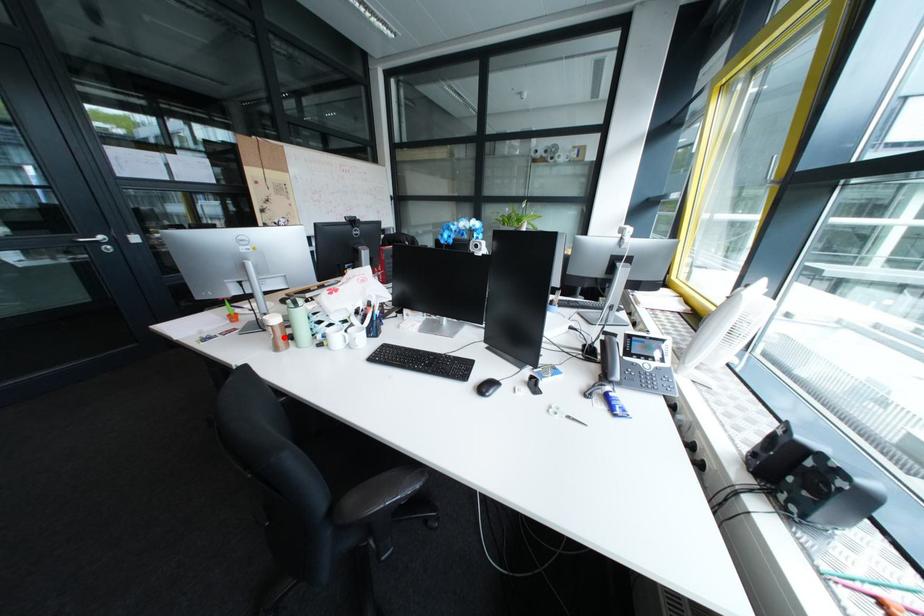
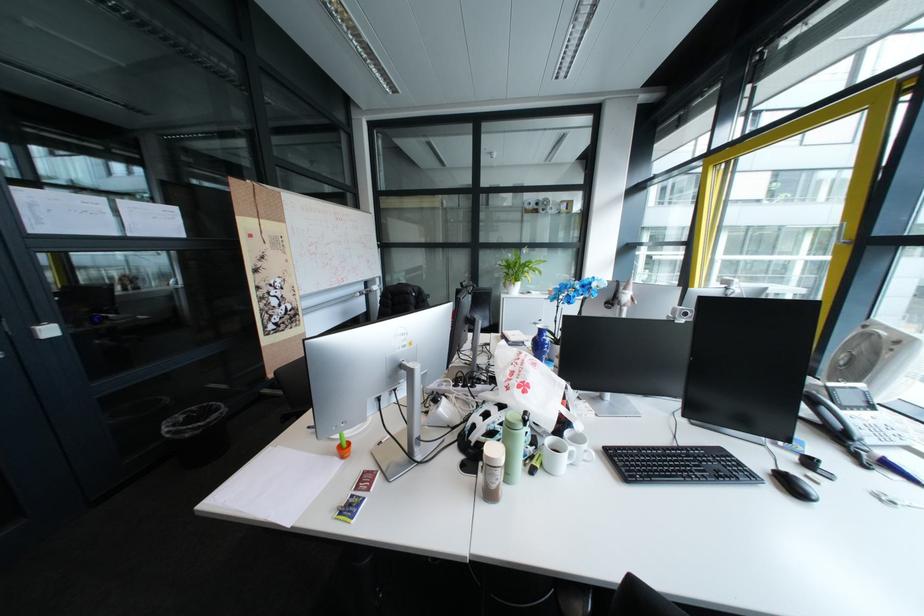
Question: I am providing you with two images of the same scene from different viewpoints. In image1, a red point is highlighted. Considering the same 3D point in image2, which of the following is correct?

Choices:
 (A) It is closer
 (B) It is farther

Answer: (B)